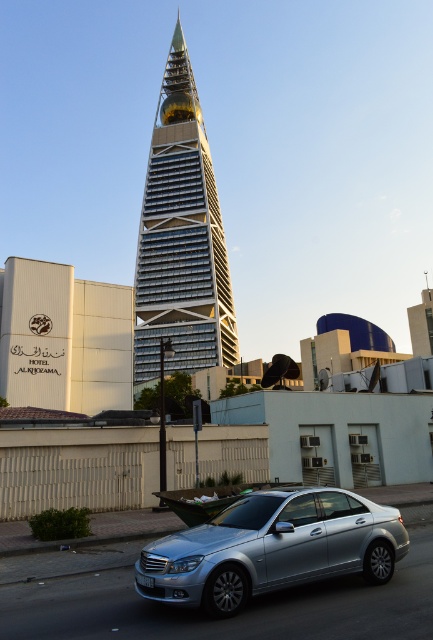
Does silver metallic skyscraper at center appear on the right side of silver metallic car at center?

In fact, silver metallic skyscraper at center is to the left of silver metallic car at center.

In the scene shown: Is silver metallic skyscraper at center bigger than silver metallic car at center?

Correct, silver metallic skyscraper at center is larger in size than silver metallic car at center.

Which is in front, point (186, 314) or point (213, 609)?

Point (213, 609) is more forward.

Locate an element on the screen. silver metallic skyscraper at center is located at coordinates (180, 237).